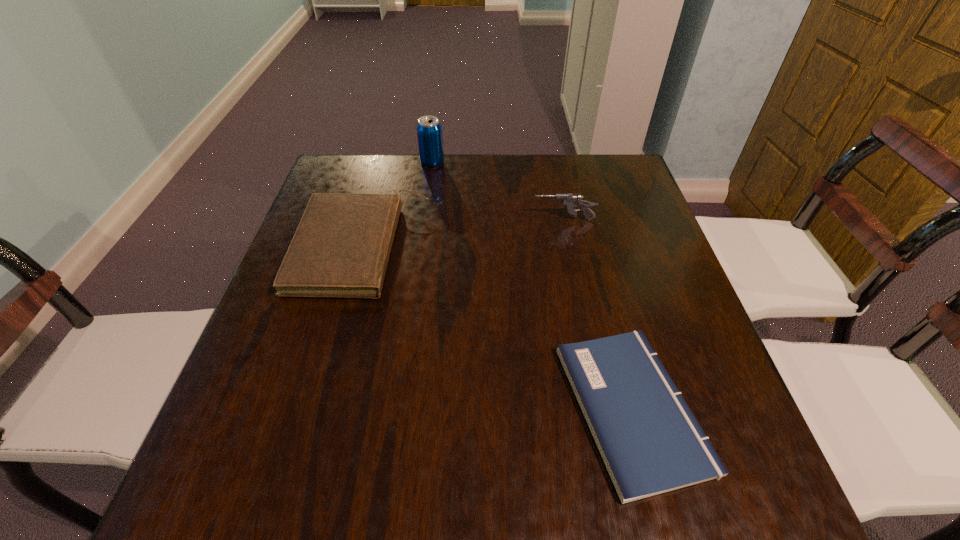
Locate an element on the screen. This screenshot has width=960, height=540. free space located at the barrel of the gun is located at coordinates (514, 220).

Find the location of a particular element. The height and width of the screenshot is (540, 960). vacant region located 0.240m on the spine side of the second shortest object is located at coordinates (522, 248).

Identify the location of free location located 0.270m on the left of the nearer paperback book. The width and height of the screenshot is (960, 540). (415, 408).

I want to click on object present at the far edge, so click(429, 130).

What are the coordinates of `object that is at the near edge` in the screenshot? It's located at (651, 443).

Find the location of a particular element. This screenshot has height=540, width=960. object situated at the left edge is located at coordinates [x=341, y=247].

Image resolution: width=960 pixels, height=540 pixels. Identify the location of gun that is at the right edge. (570, 201).

The width and height of the screenshot is (960, 540). I want to click on paperback book located in the right edge section of the desktop, so click(x=651, y=443).

Locate an element on the screen. The width and height of the screenshot is (960, 540). object at the near right corner is located at coordinates (651, 443).

At what (x,y) coordinates should I click in order to perform the action: click on free spot at the far edge of the desktop. Please return your answer as a coordinate pair (x, y). Looking at the image, I should click on click(575, 186).